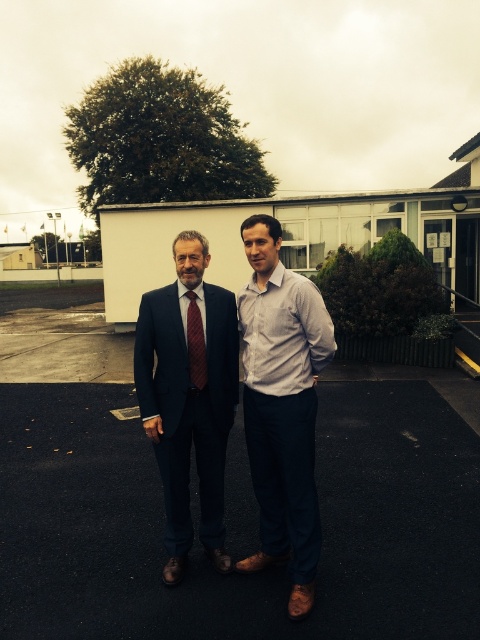
Question: Which object appears closest to the camera in this image?

Choices:
 (A) light gray cotton shirt at center
 (B) matte red tie at center
 (C) black asphalt at center

Answer: (C)

Question: Is black asphalt at center smaller than matte red tie at center?

Choices:
 (A) no
 (B) yes

Answer: (A)

Question: Considering the relative positions of black asphalt at center and matte black suit at center in the image provided, where is black asphalt at center located with respect to matte black suit at center?

Choices:
 (A) below
 (B) above

Answer: (A)

Question: Which point is closer to the camera taking this photo?

Choices:
 (A) (289, 420)
 (B) (63, 552)
 (C) (197, 456)

Answer: (A)

Question: Which object is positioned closest to the matte black suit at center?

Choices:
 (A) matte red tie at center
 (B) light gray cotton shirt at center

Answer: (A)

Question: Where is black asphalt at center located in relation to light gray cotton shirt at center in the image?

Choices:
 (A) right
 (B) left

Answer: (B)